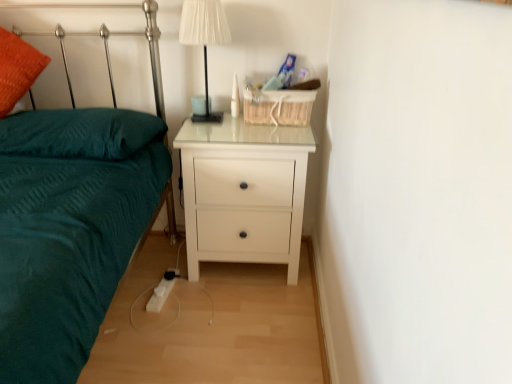
What is the approximate height of white fabric lampshade at upper center?

The height of white fabric lampshade at upper center is 18.47 inches.

This screenshot has height=384, width=512. What do you see at coordinates (243, 192) in the screenshot?
I see `white glossy nightstand at center` at bounding box center [243, 192].

Describe the element at coordinates (79, 133) in the screenshot. I see `teal soft pillow at left` at that location.

Where is `white fabric lampshade at upper center`? Image resolution: width=512 pixels, height=384 pixels. white fabric lampshade at upper center is located at coordinates (204, 38).

From a real-world perspective, who is located higher, teal fabric bed at left or teal soft pillow at left?

teal soft pillow at left.

Which object is further away from the camera, teal fabric bed at left or teal soft pillow at left?

teal soft pillow at left is further away from the camera.

Between point (143, 228) and point (119, 150), which one is positioned behind?

The point (119, 150) is behind.

At what (x,y) coordinates should I click in order to perform the action: click on nightstand below the teal fabric bed at left (from a real-world perspective). Please return your answer as a coordinate pair (x, y). The height and width of the screenshot is (384, 512). Looking at the image, I should click on (243, 192).

Considering the relative sizes of teal fabric bed at left and white glossy nightstand at center in the image provided, is teal fabric bed at left taller than white glossy nightstand at center?

Indeed, teal fabric bed at left has a greater height compared to white glossy nightstand at center.

Is teal fabric bed at left inside or outside of white glossy nightstand at center?

teal fabric bed at left is outside white glossy nightstand at center.

Considering the points (14, 241) and (242, 170), which point is in front, point (14, 241) or point (242, 170)?

The point (14, 241) is more forward.

Does teal soft pillow at left turn towards white glossy nightstand at center?

No, teal soft pillow at left is not facing towards white glossy nightstand at center.

From the image's perspective, between teal soft pillow at left and white glossy nightstand at center, which one is located above?

teal soft pillow at left, from the image's perspective.

Is teal soft pillow at left wider than white glossy nightstand at center?

Yes.

Is teal soft pillow at left smaller than white fabric lampshade at upper center?

No, teal soft pillow at left is not smaller than white fabric lampshade at upper center.

Which is in front, teal soft pillow at left or white fabric lampshade at upper center?

teal soft pillow at left is closer to the camera.

Does teal soft pillow at left appear on the left side of white fabric lampshade at upper center?

Indeed, teal soft pillow at left is positioned on the left side of white fabric lampshade at upper center.

Consider the image. Is teal soft pillow at left wider than white fabric lampshade at upper center?

Yes.

How different are the orientations of white fabric lampshade at upper center and white glossy nightstand at center in degrees?

The angular difference between white fabric lampshade at upper center and white glossy nightstand at center is 0.000818 degrees.

Are white fabric lampshade at upper center and white glossy nightstand at center far apart?

white fabric lampshade at upper center is near white glossy nightstand at center, not far away.

From a real-world perspective, is white fabric lampshade at upper center physically located above or below white glossy nightstand at center?

From a real-world perspective, white fabric lampshade at upper center is physically above white glossy nightstand at center.

Locate an element on the screen. This screenshot has width=512, height=384. bed in front of the white fabric lampshade at upper center is located at coordinates (70, 229).

Considering the relative sizes of white fabric lampshade at upper center and teal fabric bed at left in the image provided, is white fabric lampshade at upper center taller than teal fabric bed at left?

Incorrect, the height of white fabric lampshade at upper center is not larger of that of teal fabric bed at left.

Could you tell me if white fabric lampshade at upper center is turned towards teal fabric bed at left?

No, white fabric lampshade at upper center is not oriented towards teal fabric bed at left.

Looking at their sizes, would you say white fabric lampshade at upper center is wider or thinner than teal fabric bed at left?

white fabric lampshade at upper center is thinner than teal fabric bed at left.

Considering the sizes of objects white glossy nightstand at center and white fabric lampshade at upper center in the image provided, who is shorter, white glossy nightstand at center or white fabric lampshade at upper center?

With less height is white fabric lampshade at upper center.

Which of these two, white glossy nightstand at center or white fabric lampshade at upper center, is bigger?

white glossy nightstand at center is bigger.

Based on the photo, is white glossy nightstand at center thinner than white fabric lampshade at upper center?

No.

The image size is (512, 384). In order to click on table lamp that appears in front of the white glossy nightstand at center in this screenshot , I will do `click(204, 38)`.

Locate an element on the screen. pillow on the left of teal fabric bed at left is located at coordinates click(79, 133).

The width and height of the screenshot is (512, 384). Identify the location of nightstand that is on the right side of teal fabric bed at left. (243, 192).

Which object lies nearer to the anchor point white glossy nightstand at center, white fabric lampshade at upper center or teal fabric bed at left?

Among the two, white fabric lampshade at upper center is located nearer to white glossy nightstand at center.

Estimate the real-world distances between objects in this image. Which object is further from white glossy nightstand at center, teal fabric bed at left or teal soft pillow at left?

Based on the image, teal soft pillow at left appears to be further to white glossy nightstand at center.

Looking at this image, looking at the image, which one is located closer to teal fabric bed at left, white fabric lampshade at upper center or teal soft pillow at left?

teal soft pillow at left.

Based on their spatial positions, is white glossy nightstand at center or teal fabric bed at left closer to white fabric lampshade at upper center?

Based on the image, white glossy nightstand at center appears to be nearer to white fabric lampshade at upper center.

From the image, which object appears to be nearer to white glossy nightstand at center, white fabric lampshade at upper center or teal soft pillow at left?

white fabric lampshade at upper center is closer to white glossy nightstand at center.

Estimate the real-world distances between objects in this image. Which object is closer to white fabric lampshade at upper center, teal fabric bed at left or teal soft pillow at left?

teal soft pillow at left.

Which object lies further to the anchor point white fabric lampshade at upper center, teal fabric bed at left or white glossy nightstand at center?

Among the two, teal fabric bed at left is located further to white fabric lampshade at upper center.

Based on their spatial positions, is white glossy nightstand at center or teal soft pillow at left closer to white fabric lampshade at upper center?

Among the two, white glossy nightstand at center is located nearer to white fabric lampshade at upper center.

I want to click on pillow positioned between teal fabric bed at left and white fabric lampshade at upper center from near to far, so click(x=79, y=133).

Find the location of `pillow between teal fabric bed at left and white glossy nightstand at center in the front-back direction`. pillow between teal fabric bed at left and white glossy nightstand at center in the front-back direction is located at coordinates (79, 133).

I want to click on table lamp located between teal soft pillow at left and white glossy nightstand at center in the left-right direction, so click(204, 38).

At what (x,y) coordinates should I click in order to perform the action: click on table lamp located between teal fabric bed at left and white glossy nightstand at center in the depth direction. Please return your answer as a coordinate pair (x, y). This screenshot has height=384, width=512. Looking at the image, I should click on (204, 38).